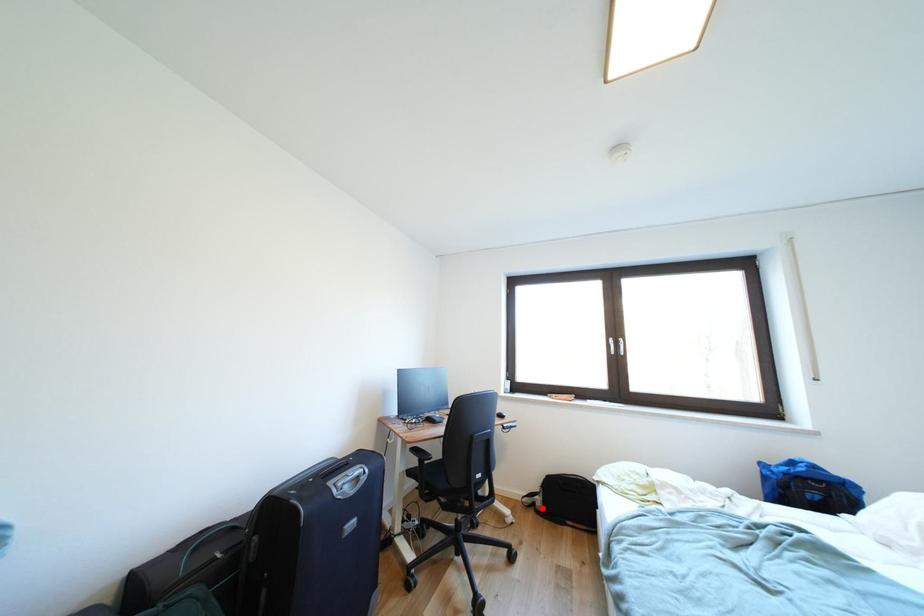
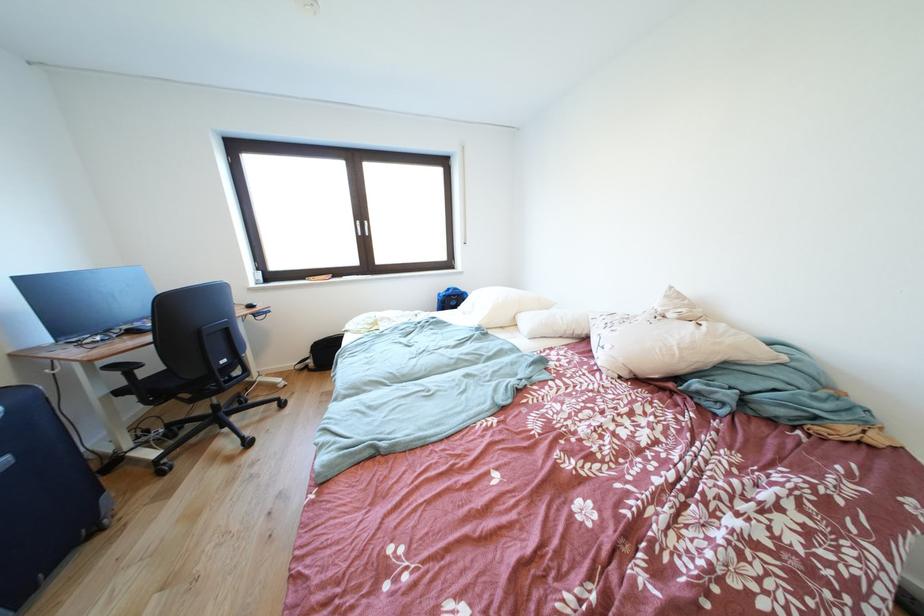
The point at the highlighted location is marked in the first image. Where is the corresponding point in the second image?

(315, 371)